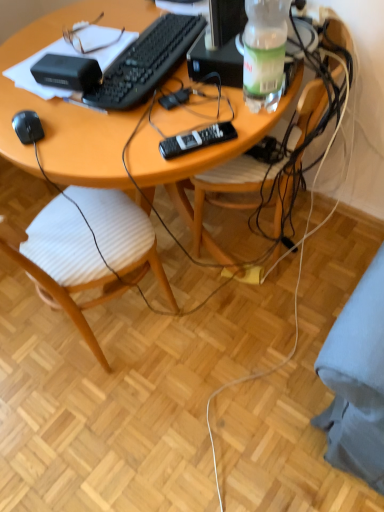
I want to click on free space in front of wooden chair at center, marked as the 2th chair in a left-to-right arrangement, so click(268, 311).